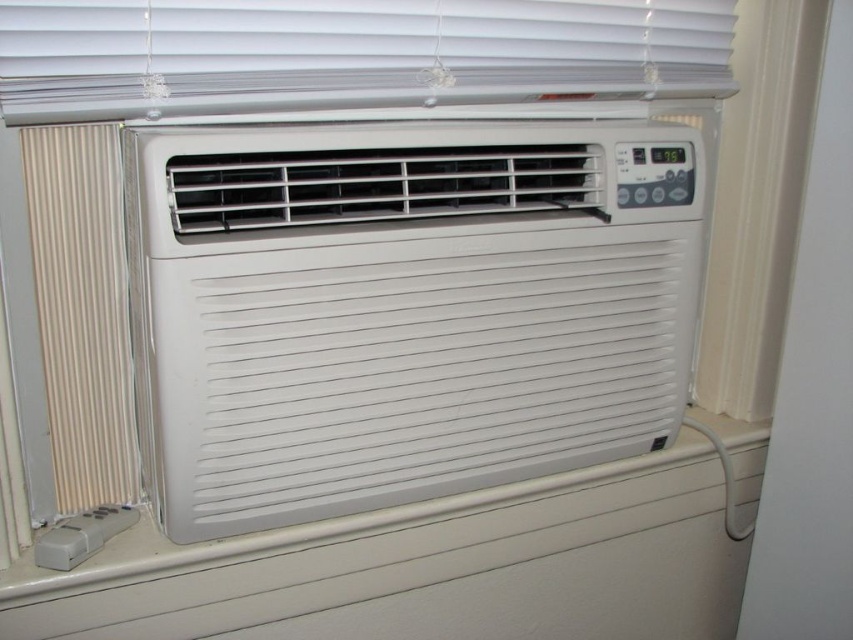
Can you confirm if white plastic blinds at upper center is wider than metallic silver radiator at left?

Yes, white plastic blinds at upper center is wider than metallic silver radiator at left.

Does white plastic blinds at upper center have a lesser height compared to metallic silver radiator at left?

Yes.

Where is `white plastic blinds at upper center`? This screenshot has width=853, height=640. white plastic blinds at upper center is located at coordinates (349, 52).

You are a GUI agent. You are given a task and a screenshot of the screen. Output one action in this format:
    pyautogui.click(x=<x>, y=<y>)
    Task: Click on the white plastic air conditioner at center
    
    Given the screenshot: What is the action you would take?
    pyautogui.click(x=399, y=314)

Is point (450, 202) closer to camera compared to point (677, 163)?

Yes, it is in front of point (677, 163).

The image size is (853, 640). Find the location of `white plastic air conditioner at center`. white plastic air conditioner at center is located at coordinates click(399, 314).

Measure the distance from white plastic air conditioner at center to metallic silver radiator at left.

white plastic air conditioner at center and metallic silver radiator at left are 9.90 inches apart.

From the picture: Can you confirm if white plastic air conditioner at center is smaller than metallic silver radiator at left?

No, white plastic air conditioner at center is not smaller than metallic silver radiator at left.

The height and width of the screenshot is (640, 853). I want to click on white plastic air conditioner at center, so [x=399, y=314].

The height and width of the screenshot is (640, 853). I want to click on white plastic air conditioner at center, so click(399, 314).